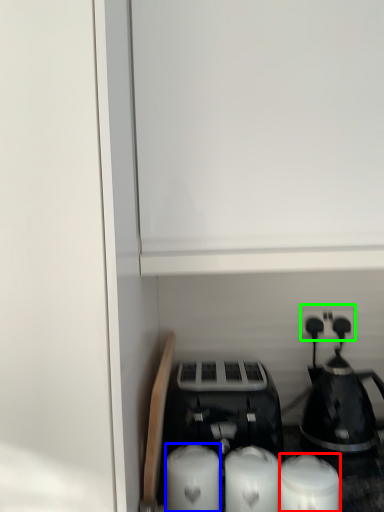
Question: Estimate the real-world distances between objects in this image. Which object is closer to candle (highlighted by a red box), candle (highlighted by a blue box) or electric outlet (highlighted by a green box)?

Choices:
 (A) candle
 (B) electric outlet

Answer: (A)